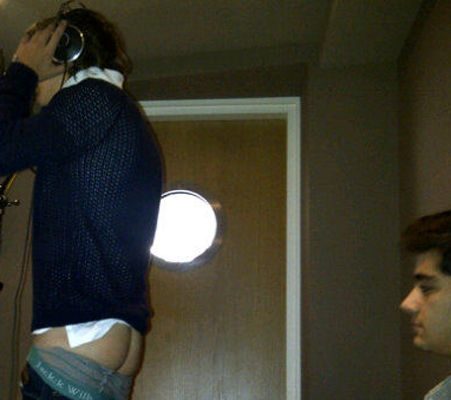
The height and width of the screenshot is (400, 451). I want to click on window, so click(x=188, y=220).